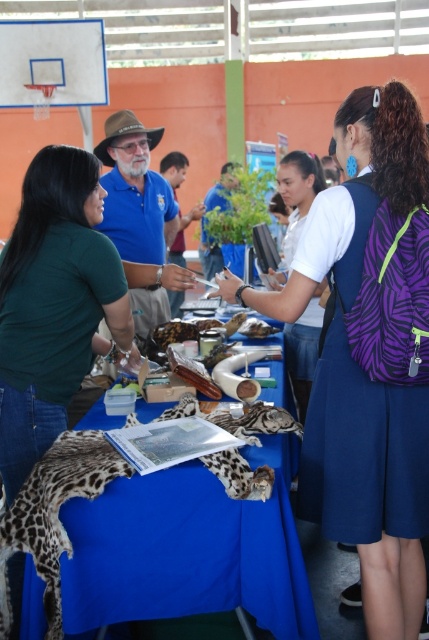
You are a participant at the event and want to grab both the matte blue shirt at center and the white matte shirt at center from the table. Which shirt should you reach for first if you want to pick up the one on the left side first?

The matte blue shirt at center is to the left of the white matte shirt at center, so you should reach for the matte blue shirt at center first.